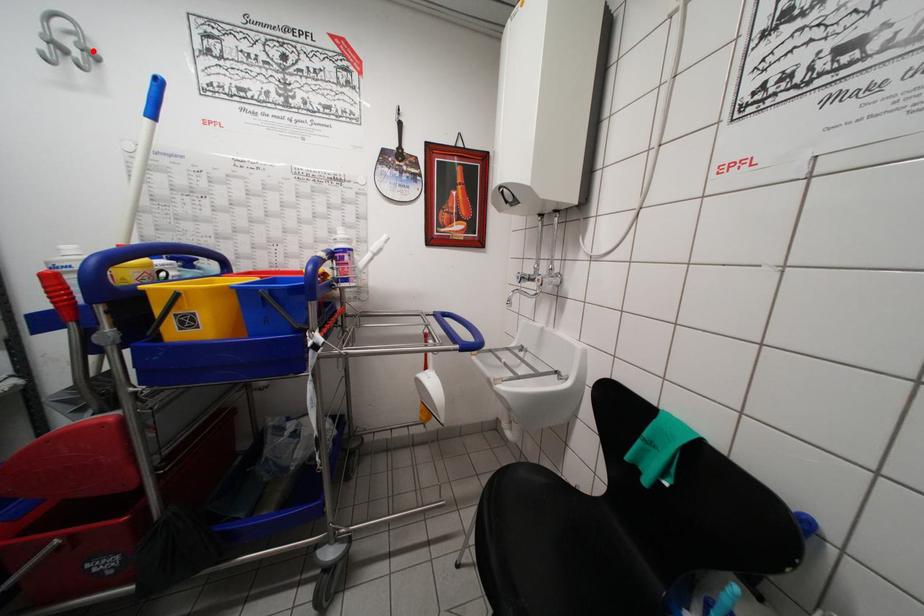
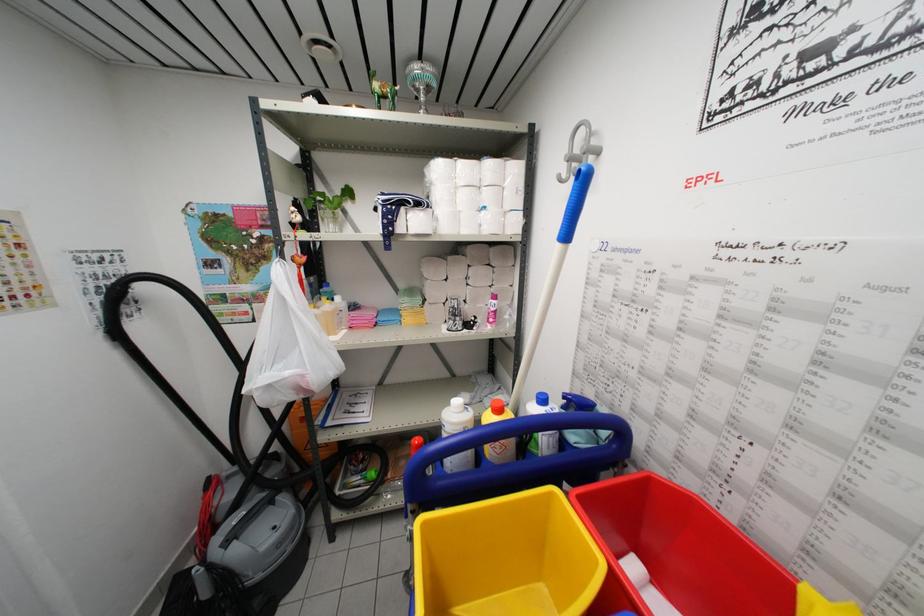
Question: I am providing you with two images of the same scene from different viewpoints. A red point is marked on the first image. Is the red point's position out of view in image 2?

Choices:
 (A) Yes
 (B) No

Answer: (B)